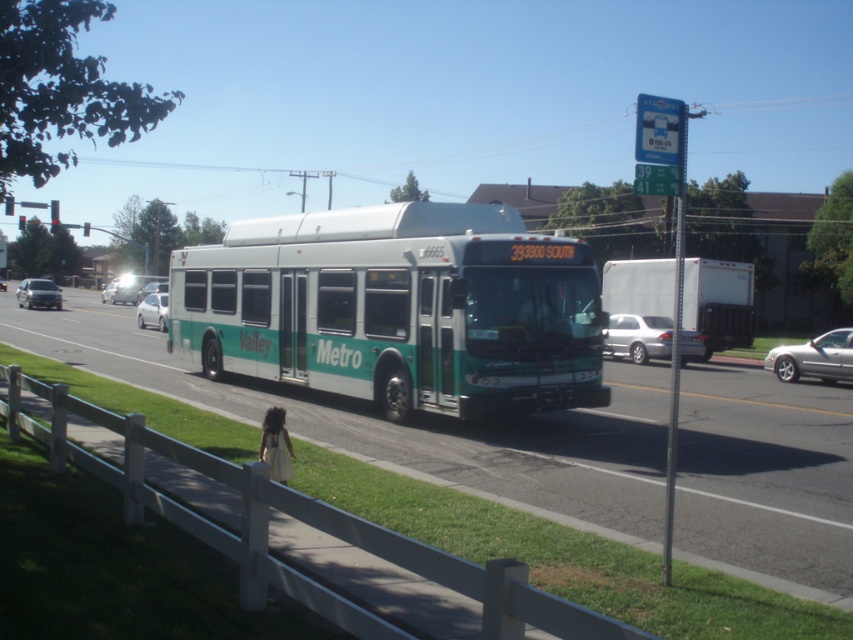
Based on the photo, you are a pedestrian standing on the sidewalk near the white wooden fence. You want to cross the road to reach the grassy area on the other side. The green matte bus at center and the silver metallic sedan at left are in your path. Which vehicle is blocking your path closer to you?

The silver metallic sedan at left is closer to you because the green matte bus at center is positioned under it, meaning the sedan is above the bus from your perspective, indicating it is farther away.

You are a pedestrian standing on the sidewalk near the white wooden fence. You see the green matte bus at center and the silver metallic sedan at left. Which vehicle is nearer to you?

The green matte bus at center is closer to the viewer than the silver metallic sedan at left, so the green matte bus at center is nearer to you.

You are a pedestrian standing at point (x=611, y=348) and want to cross the road to reach a park located at point (x=531, y=403). Is the path from your current position to the park clear of any obstacles?

Point (x=531, y=403) is in front of point (x=611, y=348), so the path from your current position to the park is clear of any obstacles.